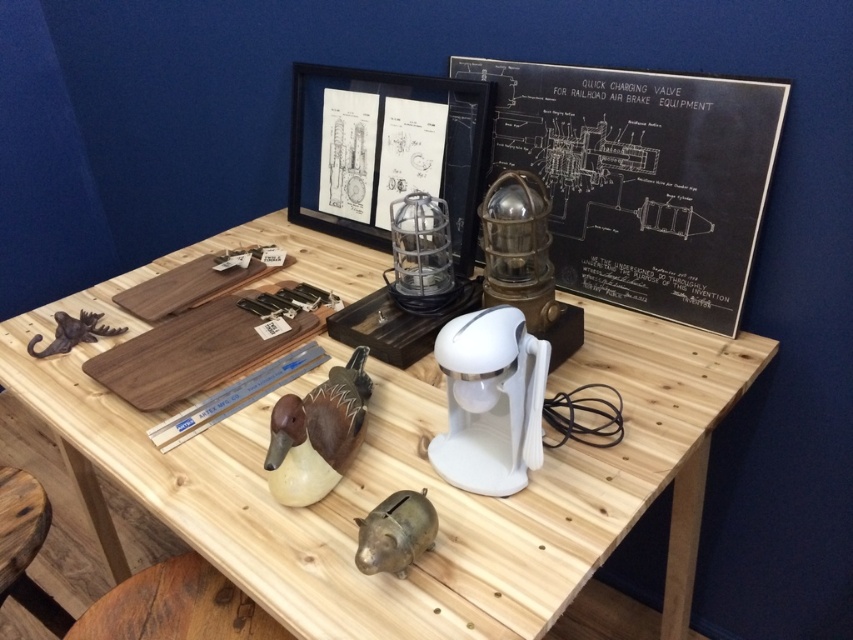
Between natural wood table at center and black paperboard at center, which one has more height?

Standing taller between the two is natural wood table at center.

Who is more forward, [178,468] or [323,168]?

Positioned in front is point [178,468].

I want to click on natural wood table at center, so click(399, 467).

Who is more distant from viewer, (340, 492) or (54, 339)?

Point (54, 339)

Is natural wood table at center thinner than brown matte hook at left?

In fact, natural wood table at center might be wider than brown matte hook at left.

Find the location of a particular element. Image resolution: width=853 pixels, height=640 pixels. natural wood table at center is located at coordinates click(x=399, y=467).

The image size is (853, 640). In order to click on natural wood table at center in this screenshot , I will do `click(399, 467)`.

Can you confirm if brown matte duck at center is wider than brown matte hook at left?

No, brown matte duck at center is not wider than brown matte hook at left.

This screenshot has width=853, height=640. Identify the location of brown matte duck at center. (317, 433).